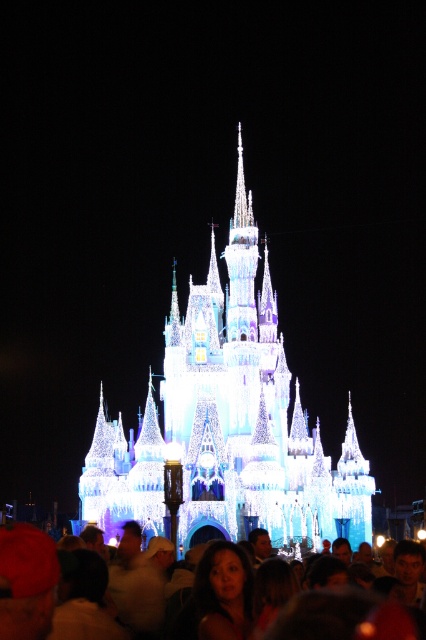
You are a photographer trying to capture the entire scene of the illuminated glass castle at center and the matte white crowd at lower center in one shot. Based on their widths, which object should you ensure is fully in frame first?

The illuminated glass castle at center is wider than the matte white crowd at lower center. Therefore, you should ensure the illuminated glass castle at center is fully in frame first to accommodate its greater width.

You are a photographer trying to capture the illuminated glass castle at center and the matte white crowd at lower center in a single shot. Based on their sizes, which object should you focus on first to ensure both are in frame?

The illuminated glass castle at center is larger in size than the matte white crowd at lower center, so you should focus on the illuminated glass castle at center first to ensure both fit in the frame.

You are a photographer standing at the edge of the scene, wanting to capture a photo where the illuminated glass castle at center is clearly visible above the matte white crowd at lower center. Based on their heights, will the castle be fully visible in your photo?

The illuminated glass castle at center is much taller than the matte white crowd at lower center, so the castle will be fully visible above them in the photo.